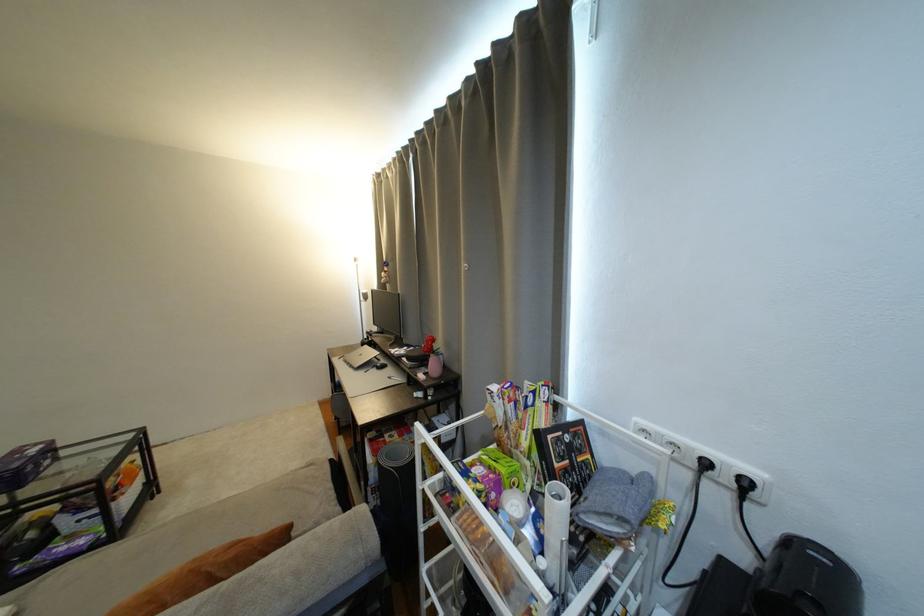
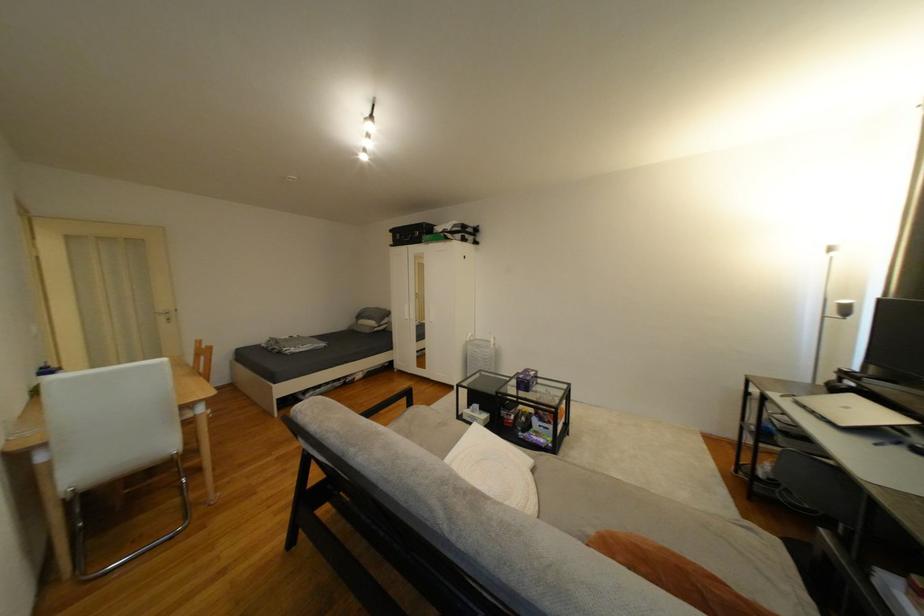
Question: The images are taken continuously from a first-person perspective. In which direction is your viewpoint rotating?

Choices:
 (A) Left
 (B) Right
 (C) Up
 (D) Down

Answer: (A)